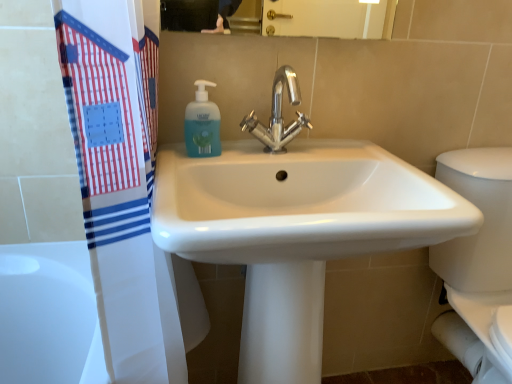
The image size is (512, 384). Find the location of `vacant space to the right of translucent plastic soap dispenser at upper center`. vacant space to the right of translucent plastic soap dispenser at upper center is located at coordinates point(243,156).